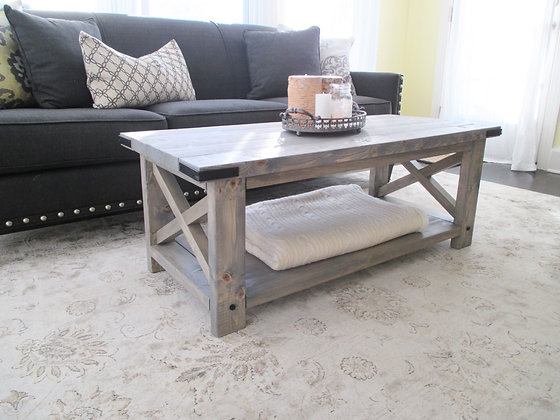
In order to click on wall in this screenshot , I will do `click(424, 55)`.